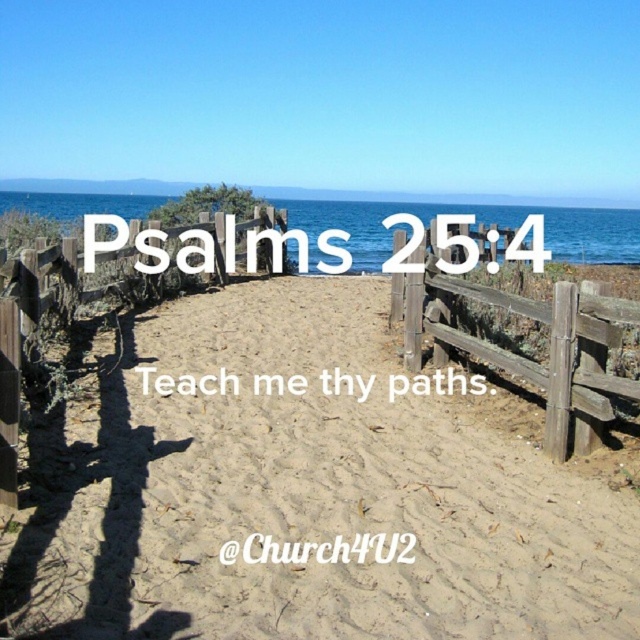
Question: Does brown sandy path at center appear on the right side of weathered wood fence at center?

Choices:
 (A) yes
 (B) no

Answer: (B)

Question: Among these objects, which one is farthest from the camera?

Choices:
 (A) weathered wood fence at center
 (B) wooden fence at center
 (C) brown sandy path at center

Answer: (A)

Question: Can you confirm if weathered wood fence at center is bigger than wooden fence at center?

Choices:
 (A) yes
 (B) no

Answer: (B)

Question: Is brown sandy path at center above weathered wood fence at center?

Choices:
 (A) yes
 (B) no

Answer: (B)

Question: Among these points, which one is farthest from the camera?

Choices:
 (A) (572, 372)
 (B) (54, 291)
 (C) (236, 524)

Answer: (B)

Question: Which point is farther to the camera?

Choices:
 (A) wooden fence at center
 (B) brown sandy path at center
 (C) weathered wood fence at center

Answer: (C)